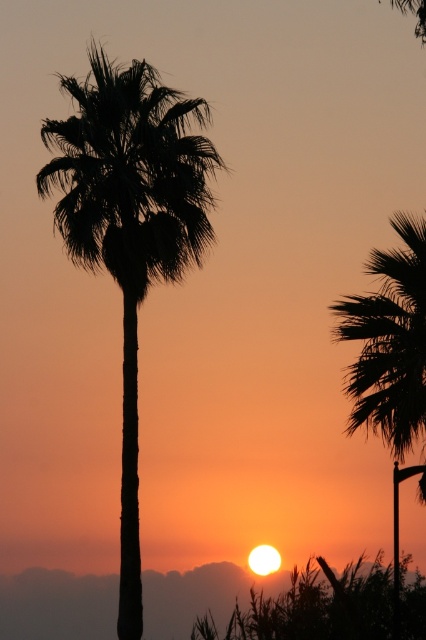
You are an artist trying to paint the sunset scene. You want to ensure the palm trees are proportionally accurate. Which of the two silhouette leafy palm at center or silhouette leafy palm at right should you paint smaller in your artwork?

The silhouette leafy palm at center should be painted smaller because it occupies less space than the silhouette leafy palm at right.

You are a drone operator trying to capture the perfect shot of the palm tree at the center of the scene. The coordinates given are in normalized image coordinates where the origin is at the bottom left corner. Can you confirm if the point marked at point (129,227) is indeed the center of the silhouette leafy palm?

Yes, the point (129,227) marks the silhouette leafy palm at center as stated in the description.